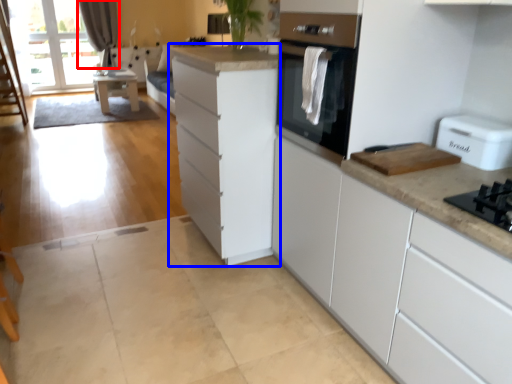
Question: Which point is further to the camera, curtain (highlighted by a red box) or cabinetry (highlighted by a blue box)?

Choices:
 (A) curtain
 (B) cabinetry

Answer: (A)